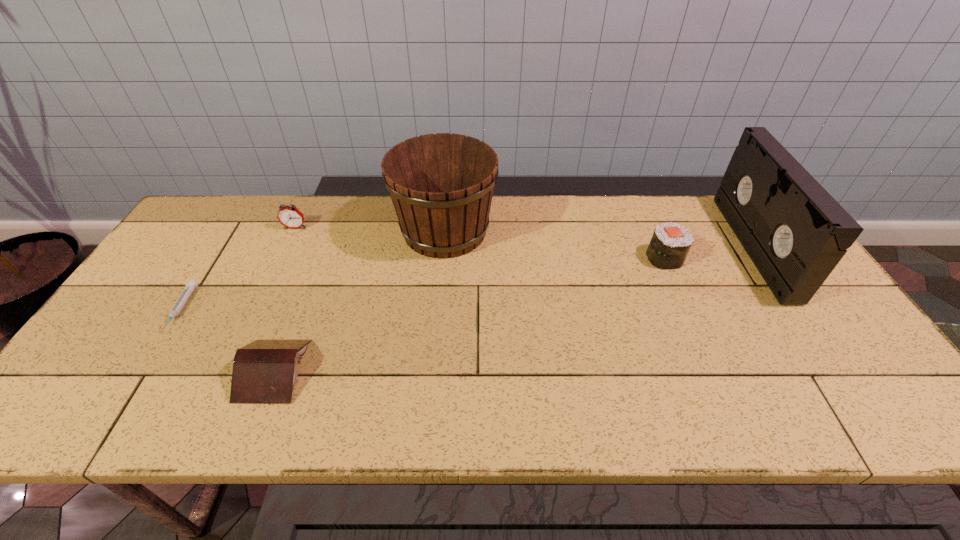
Identify the location of object present at the left edge. (191, 284).

You are a GUI agent. You are given a task and a screenshot of the screen. Output one action in this format:
    pyautogui.click(x=<x>, y=<y>)
    Task: Click on the object present at the right edge
    
    Given the screenshot: What is the action you would take?
    pyautogui.click(x=794, y=231)

I want to click on object that is at the far right corner, so click(x=794, y=231).

In the image, there is a desktop. At what (x,y) coordinates should I click in order to perform the action: click on vacant space at the far edge. Please return your answer as a coordinate pair (x, y). The width and height of the screenshot is (960, 540). Looking at the image, I should click on (298, 237).

Where is `free region at the near edge of the desktop`? The image size is (960, 540). free region at the near edge of the desktop is located at coordinates (769, 429).

The height and width of the screenshot is (540, 960). Identify the location of vacant space at the far left corner of the desktop. (214, 241).

Locate an element on the screen. This screenshot has width=960, height=540. free space between the book and the second object from right to left is located at coordinates (469, 314).

The image size is (960, 540). I want to click on vacant area that lies between the fifth object from left to right and the syringe, so click(422, 284).

Where is `unoccupied area between the sushi and the shortest object`? The image size is (960, 540). unoccupied area between the sushi and the shortest object is located at coordinates (422, 284).

Identify the location of vacant area between the nearest object and the third object from right to left. (359, 301).